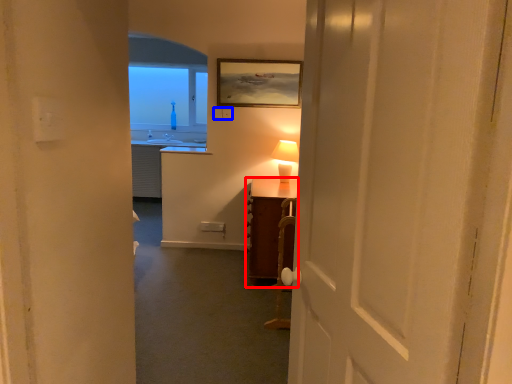
Question: Which object is further to the camera taking this photo, table (highlighted by a red box) or electric outlet (highlighted by a blue box)?

Choices:
 (A) table
 (B) electric outlet

Answer: (B)